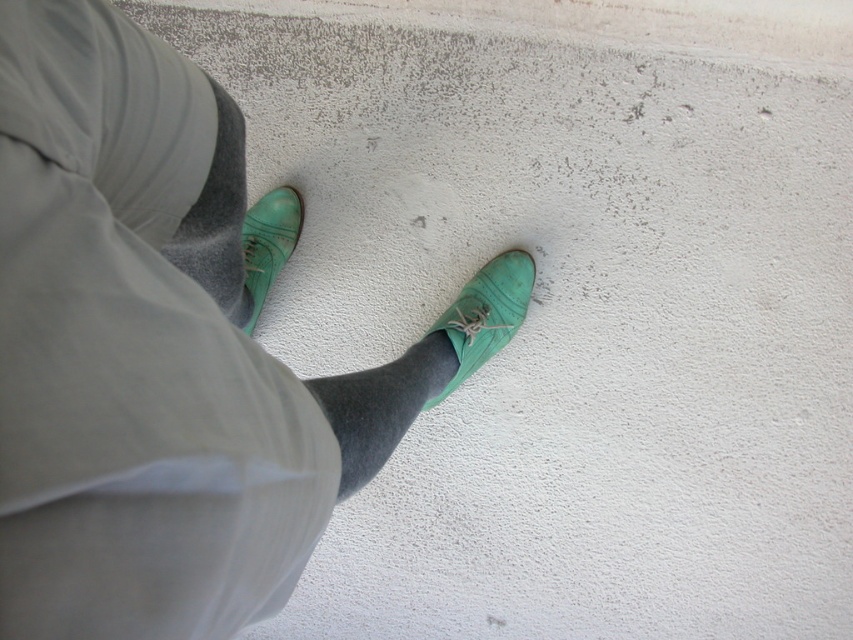
Looking at this image, who is lower down, gray/soft fabric sock at center or matte green shoe at center?

gray/soft fabric sock at center is below.

Between point (379, 380) and point (492, 289), which one is positioned in front?

Point (379, 380) is in front.

Find the location of `gray/soft fabric sock at center`. gray/soft fabric sock at center is located at coordinates (381, 404).

From the picture: Does matte green shoes at center have a lesser width compared to gray/soft fabric sock at center?

In fact, matte green shoes at center might be wider than gray/soft fabric sock at center.

Is matte green shoes at center smaller than gray/soft fabric sock at center?

No.

Between point (456, 368) and point (383, 458), which one is positioned behind?

The point (456, 368) is behind.

This screenshot has width=853, height=640. I want to click on matte green shoes at center, so click(165, 352).

Can you confirm if matte green shoes at center is taller than matte green shoe at center?

Indeed, matte green shoes at center has a greater height compared to matte green shoe at center.

Does point (225, 248) come closer to viewer compared to point (469, 298)?

Yes.

Identify the location of matte green shoes at center. This screenshot has width=853, height=640. (165, 352).